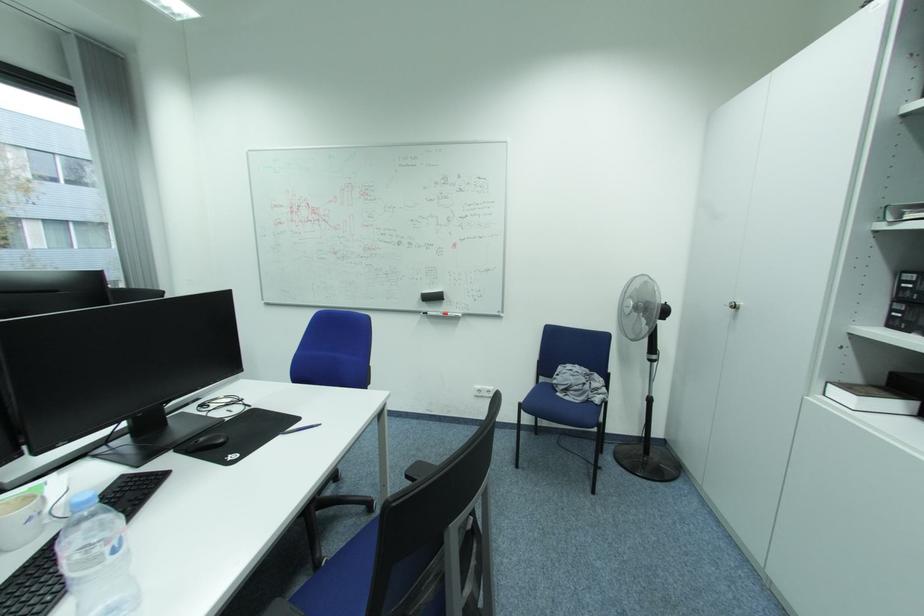
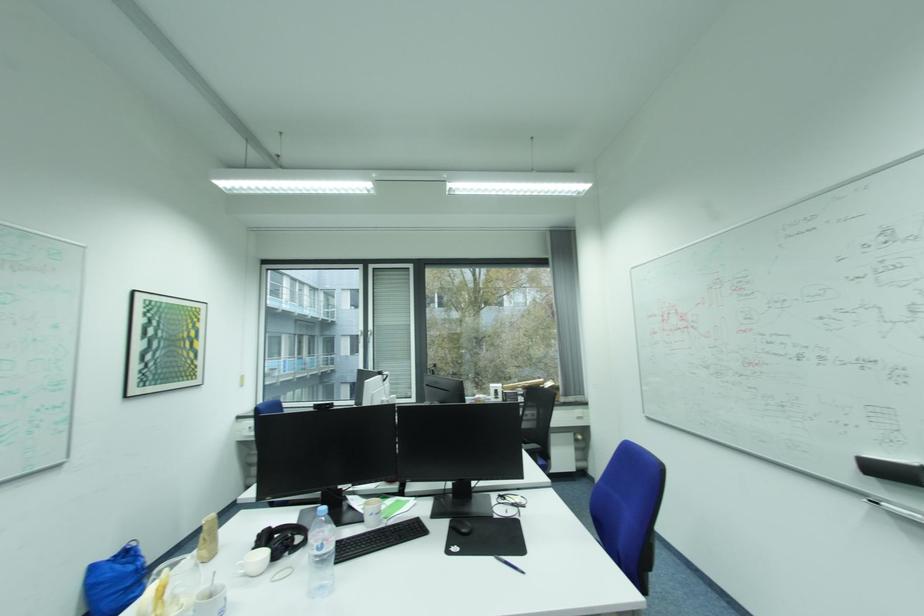
Question: The first image is from the beginning of the video and the second image is from the end. How did the camera likely rotate when shooting the video?

Choices:
 (A) Left
 (B) Right
 (C) Up
 (D) Down

Answer: (A)